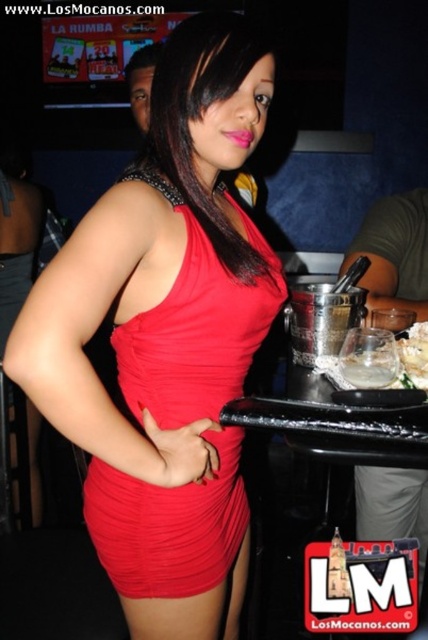
Can you confirm if shiny red dress at center is bigger than white crumbly cake at center?

Yes.

Is point (83, 268) closer to camera compared to point (395, 385)?

Yes, point (83, 268) is in front of point (395, 385).

Find the location of a particular element. The height and width of the screenshot is (640, 428). shiny red dress at center is located at coordinates (166, 339).

Can you confirm if shiny satin dress at center is positioned to the right of white crumbly cake at center?

No, shiny satin dress at center is not to the right of white crumbly cake at center.

Describe the element at coordinates (196, 326) in the screenshot. I see `shiny satin dress at center` at that location.

This screenshot has height=640, width=428. Find the location of `shiny satin dress at center`. shiny satin dress at center is located at coordinates (196, 326).

Can you confirm if shiny satin dress at center is taller than clear glass at lower right?

Yes, shiny satin dress at center is taller than clear glass at lower right.

Who is higher up, shiny satin dress at center or clear glass at lower right?

Positioned higher is clear glass at lower right.

Find the location of a particular element. shiny satin dress at center is located at coordinates (196, 326).

You are a GUI agent. You are given a task and a screenshot of the screen. Output one action in this format:
    pyautogui.click(x=<x>, y=<y>)
    Task: Click on the shiny satin dress at center
    
    Given the screenshot: What is the action you would take?
    196,326